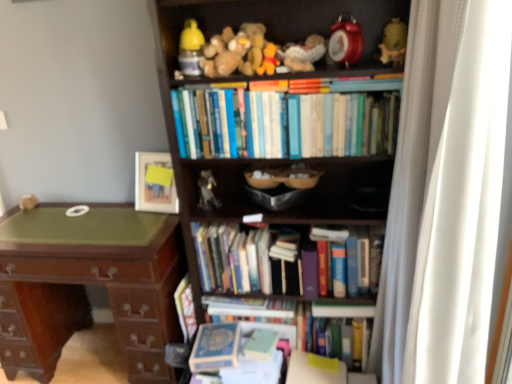
Question: Which direction should I rotate to look at hardcover book at center, which appears as the third book when viewed from the top, — up or down?

Choices:
 (A) down
 (B) up

Answer: (A)

Question: Is hardcover book at lower center, the 5th book in the top-to-bottom sequence, shorter than hardcover books at center, marked as the fifth book in a bottom-to-top arrangement?

Choices:
 (A) yes
 (B) no

Answer: (A)

Question: Can you confirm if hardcover book at lower center, the first book from the bottom, is positioned to the left of hardcover books at center, which is the first book from top to bottom?

Choices:
 (A) no
 (B) yes

Answer: (B)

Question: Would you say hardcover books at center, marked as the fifth book in a bottom-to-top arrangement, is part of hardcover book at lower center, the 5th book in the top-to-bottom sequence,'s contents?

Choices:
 (A) yes
 (B) no

Answer: (B)

Question: Considering the relative positions of hardcover book at lower center, the first book from the bottom, and hardcover books at center, marked as the fifth book in a bottom-to-top arrangement, in the image provided, is hardcover book at lower center, the first book from the bottom, to the right of hardcover books at center, marked as the fifth book in a bottom-to-top arrangement, from the viewer's perspective?

Choices:
 (A) no
 (B) yes

Answer: (A)

Question: Is hardcover book at lower center, the 5th book in the top-to-bottom sequence, wider than hardcover books at center, which is the first book from top to bottom?

Choices:
 (A) yes
 (B) no

Answer: (A)

Question: Is hardcover book at lower center, the 5th book in the top-to-bottom sequence, looking in the opposite direction of hardcover books at center, which is the first book from top to bottom?

Choices:
 (A) yes
 (B) no

Answer: (B)

Question: Does hardcover book at center, which is counted as the third book, starting from the bottom, appear on the left side of green polished wood desk at left?

Choices:
 (A) no
 (B) yes

Answer: (A)

Question: Is hardcover book at center, which appears as the third book when viewed from the top, closer to the viewer compared to green polished wood desk at left?

Choices:
 (A) yes
 (B) no

Answer: (B)

Question: Can you confirm if hardcover book at center, which is counted as the third book, starting from the bottom, is taller than green polished wood desk at left?

Choices:
 (A) no
 (B) yes

Answer: (A)

Question: From the image's perspective, is hardcover book at center, which is counted as the third book, starting from the bottom, located beneath green polished wood desk at left?

Choices:
 (A) yes
 (B) no

Answer: (A)

Question: Is hardcover book at center, which is counted as the third book, starting from the bottom, outside of green polished wood desk at left?

Choices:
 (A) no
 (B) yes

Answer: (A)

Question: From a real-world perspective, is hardcover book at center, which is counted as the third book, starting from the bottom, beneath green polished wood desk at left?

Choices:
 (A) yes
 (B) no

Answer: (A)

Question: From the image's perspective, does fuzzy fabric stuffed animal at upper center, arranged as the fifth toy when viewed from the right, appear higher than matte yellow ceramic vase at upper right, positioned as the ninth toy in left-to-right order?

Choices:
 (A) yes
 (B) no

Answer: (B)